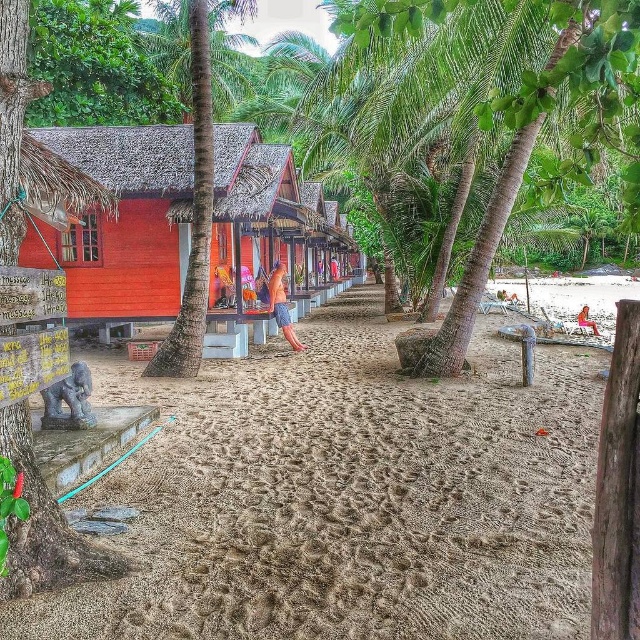
Question: Among these points, which one is nearest to the camera?

Choices:
 (A) (211, 136)
 (B) (300, 344)
 (C) (477, 440)
 (D) (179, 163)

Answer: (C)

Question: Does brown sandy beach at center lie behind orange fabric towel at center?

Choices:
 (A) no
 (B) yes

Answer: (A)

Question: Where is matte red wooden hut at center located in relation to orange fabric towel at center in the image?

Choices:
 (A) left
 (B) right

Answer: (A)

Question: Which point appears closest to the camera in this image?

Choices:
 (A) (284, 316)
 (B) (106, 182)
 (C) (579, 321)

Answer: (B)

Question: Is brown sandy beach at center to the left of smooth tan skin at center from the viewer's perspective?

Choices:
 (A) yes
 (B) no

Answer: (B)

Question: Which object appears closest to the camera in this image?

Choices:
 (A) matte red wooden hut at center
 (B) smooth tan skin at center
 (C) brown sandy beach at center
 (D) green leafy palm tree at center

Answer: (C)